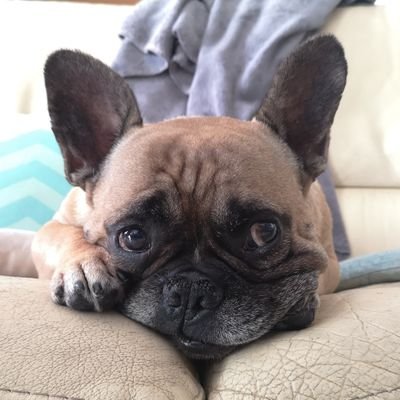
Locate an element on the screen. The image size is (400, 400). blanket is located at coordinates (225, 62).